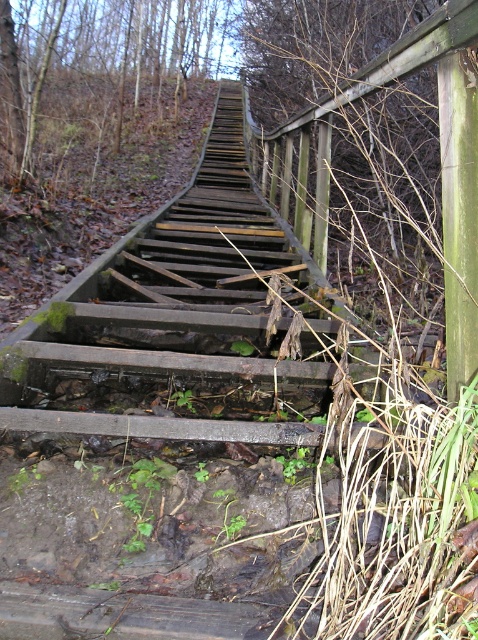
You are standing on the ground near the weathered wood stairs at center. You want to climb up the stairs but need to check if the point at coordinates (197, 326) is safe to step on. Is this point located on the stairs?

The point at coordinates (197, 326) corresponds to the weathered wood stairs at center, so yes, this point is located on the stairs.

You are a hiker who wants to take a photo of the weathered wood stairs at center and the green leafy weed at center. Which object should you focus on first to ensure both are in sharp focus?

The weathered wood stairs at center is closer to the viewer than the green leafy weed at center. To ensure both are in sharp focus, you should focus on the weathered wood stairs at center first, as it is the closer object.

You are a hiker navigating through a wooded area and come across the weathered wood stairs at center. Based on their location, can you determine if they are positioned centrally within the image?

The weathered wood stairs at center are located at point coordinates approximately at the center of the image, so yes, they are positioned centrally within the image.